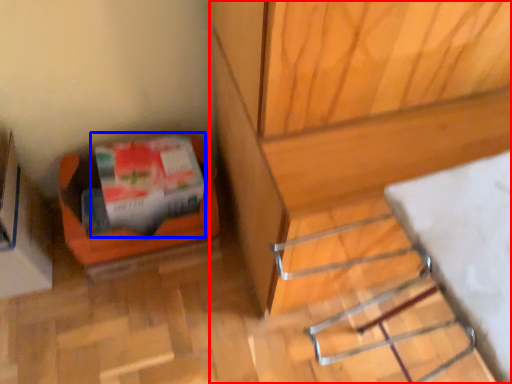
Question: Among these objects, which one is farthest to the camera, furniture (highlighted by a red box) or wrapping paper (highlighted by a blue box)?

Choices:
 (A) furniture
 (B) wrapping paper

Answer: (B)